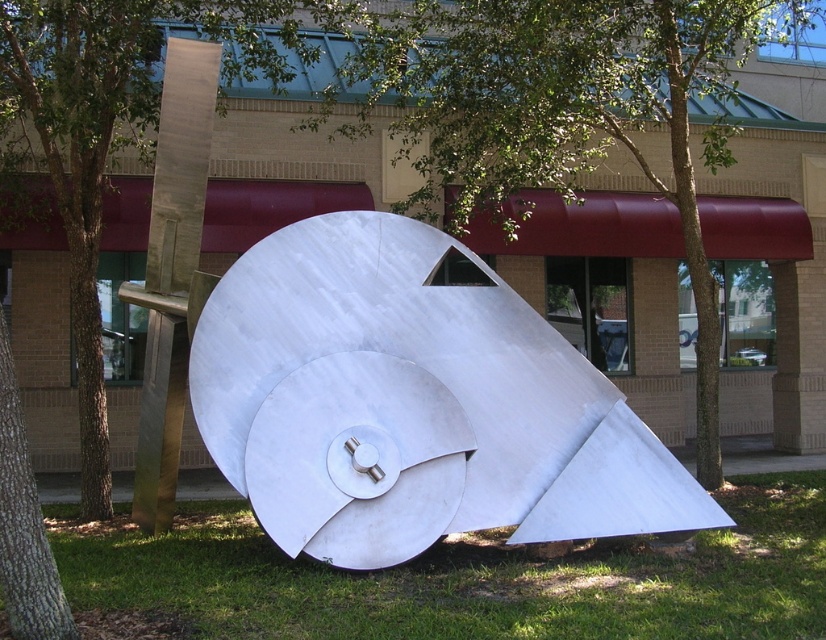
Is metallic silver sculpture at center positioned in front of green grass at lower center?

No.

Is metallic silver sculpture at center below green grass at lower center?

Incorrect, metallic silver sculpture at center is not positioned below green grass at lower center.

This screenshot has height=640, width=826. In order to click on metallic silver sculpture at center in this screenshot , I will do `click(413, 403)`.

The height and width of the screenshot is (640, 826). Find the location of `metallic silver sculpture at center`. metallic silver sculpture at center is located at coordinates (413, 403).

Which is above, green grass at lower center or green leafy tree at center?

green leafy tree at center is above.

Between green grass at lower center and green leafy tree at center, which one appears on the right side from the viewer's perspective?

green leafy tree at center

Image resolution: width=826 pixels, height=640 pixels. I want to click on green grass at lower center, so click(457, 579).

Does metallic silver sculpture at center lie behind green leafy tree at center?

That is False.

You are a GUI agent. You are given a task and a screenshot of the screen. Output one action in this format:
    pyautogui.click(x=<x>, y=<y>)
    Task: Click on the metallic silver sculpture at center
    The width and height of the screenshot is (826, 640).
    Given the screenshot: What is the action you would take?
    pyautogui.click(x=413, y=403)